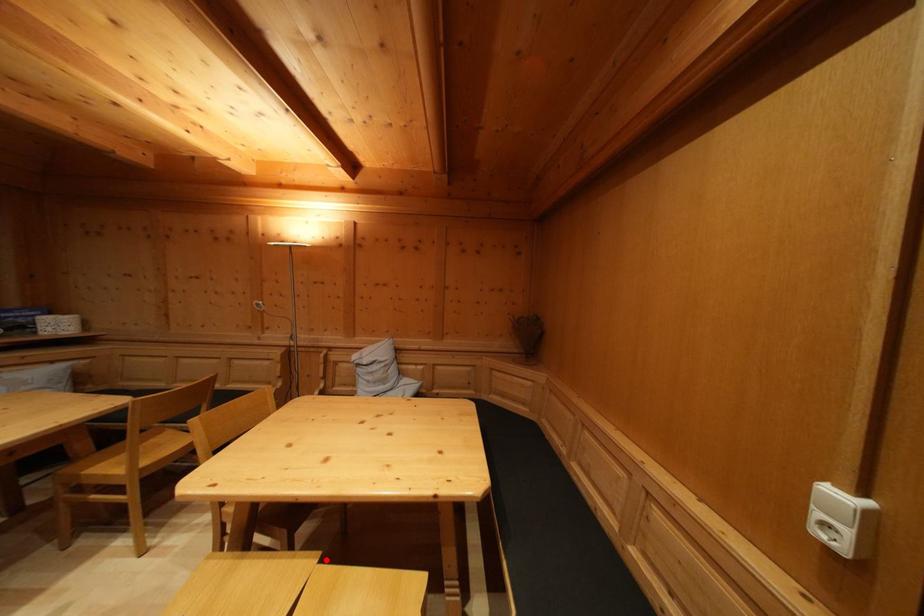
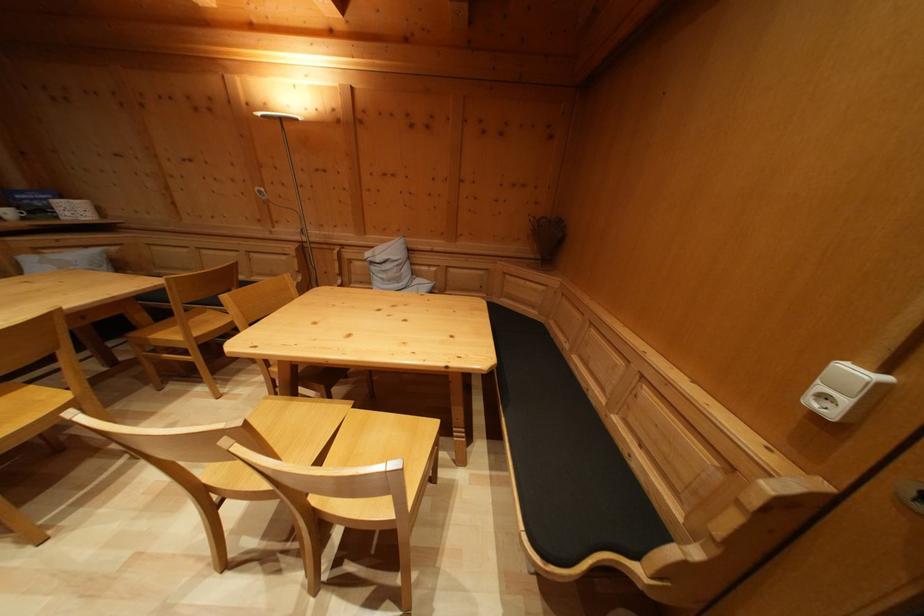
In the second image, find the point that corresponds to the highlighted location in the first image.

(359, 408)